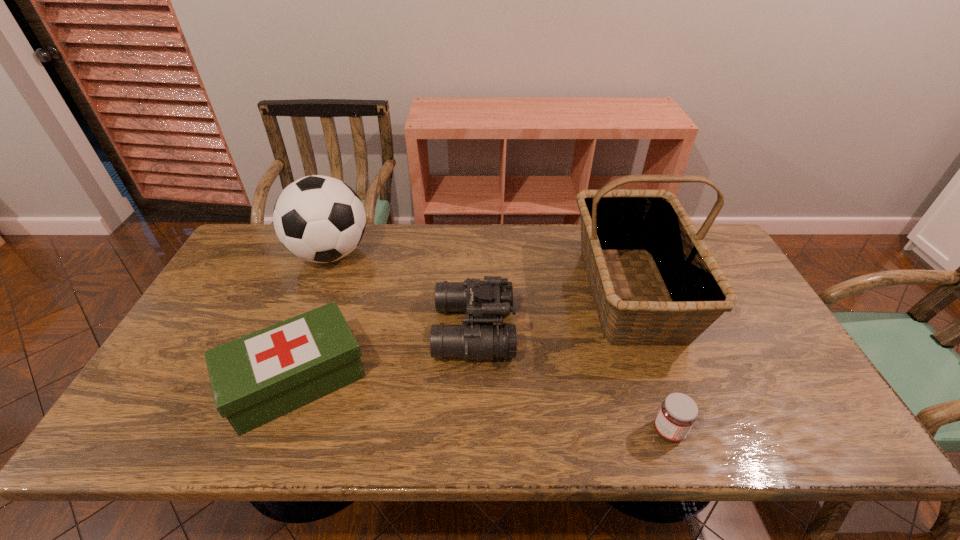
This screenshot has height=540, width=960. I want to click on free region located 0.190m on the left of the shortest object, so click(x=567, y=431).

Locate an element on the screen. This screenshot has width=960, height=540. basket present at the far edge is located at coordinates (614, 221).

The width and height of the screenshot is (960, 540). I want to click on soccer ball at the far edge, so click(320, 219).

The width and height of the screenshot is (960, 540). I want to click on the first-aid kit at the near edge, so click(x=257, y=378).

This screenshot has width=960, height=540. What are the coordinates of `jam positioned at the near edge` in the screenshot? It's located at (678, 412).

The image size is (960, 540). What are the coordinates of `vacant region at the far edge of the desktop` in the screenshot? It's located at (514, 228).

In the image, there is a desktop. Identify the location of vacant space at the near edge. Image resolution: width=960 pixels, height=540 pixels. (757, 448).

Find the location of a particular element. vacant space at the left edge is located at coordinates (261, 295).

Where is `vacant region at the right edge of the desktop`? The image size is (960, 540). vacant region at the right edge of the desktop is located at coordinates (793, 402).

This screenshot has height=540, width=960. Find the location of `free space at the far right corner of the desktop`. free space at the far right corner of the desktop is located at coordinates (725, 261).